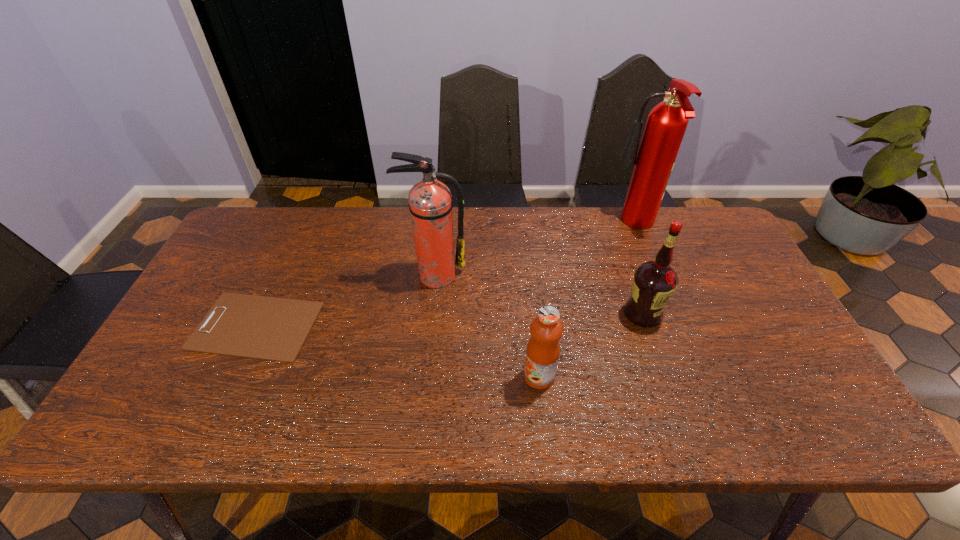
You are a GUI agent. You are given a task and a screenshot of the screen. Output one action in this format:
    pyautogui.click(x=<x>, y=<y>)
    Task: Click on the vacant area situated at the nozzle of the taller fire extinguisher
    The height and width of the screenshot is (540, 960).
    Given the screenshot: What is the action you would take?
    pyautogui.click(x=560, y=226)

What are the coordinates of `free space located 0.240m at the nozzle of the taller fire extinguisher` in the screenshot? It's located at (538, 226).

The width and height of the screenshot is (960, 540). Identify the location of vacant region located at the nozzle of the second tallest object. (428, 337).

At what (x,y) coordinates should I click in order to perform the action: click on vacant space positioned 0.160m on the label of the third tallest object. Please return your answer as a coordinate pair (x, y). Looking at the image, I should click on (666, 382).

Find the location of a particular element. The image size is (960, 540). free space located on the front label of the third object from right to left is located at coordinates (486, 376).

Find the location of a particular element. Image resolution: width=960 pixels, height=540 pixels. vacant space located 0.060m on the front label of the third object from right to left is located at coordinates (498, 376).

You are a GUI agent. You are given a task and a screenshot of the screen. Output one action in this format:
    pyautogui.click(x=<x>, y=<y>)
    Task: Click on the blank area located 0.260m on the front label of the third object from right to left
    Image resolution: width=960 pixels, height=540 pixels.
    Given the screenshot: What is the action you would take?
    pyautogui.click(x=415, y=376)

This screenshot has width=960, height=540. I want to click on vacant space situated on the right of the leftmost object, so click(x=393, y=326).

Find the location of `object that is at the far edge`. object that is at the far edge is located at coordinates tap(666, 124).

Locate an element on the screen. This screenshot has width=960, height=540. object at the left edge is located at coordinates (269, 328).